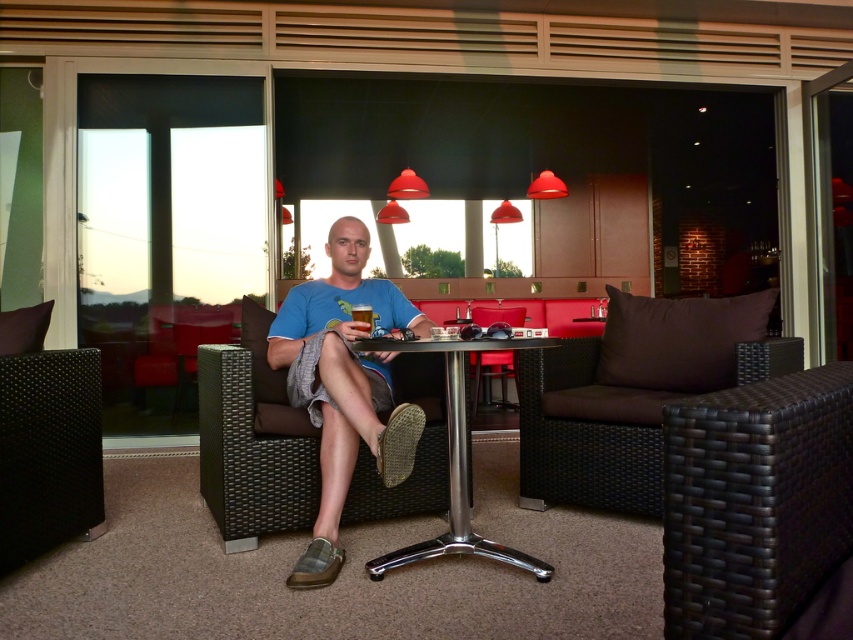
Question: Is brown wicker chair at center below brown wicker armchair at center?

Choices:
 (A) yes
 (B) no

Answer: (B)

Question: Does brown woven couch at center appear on the left side of brown wicker chair at center?

Choices:
 (A) no
 (B) yes

Answer: (A)

Question: From the image, what is the correct spatial relationship of blue fabric shirt at center in relation to translucent glass beer at center?

Choices:
 (A) above
 (B) below

Answer: (B)

Question: Which point is closer to the camera?

Choices:
 (A) brown woven chair at right
 (B) transparent glass door at upper left

Answer: (A)

Question: Which of the following is the farthest from the observer?

Choices:
 (A) pos(218,324)
 (B) pos(728,451)

Answer: (A)

Question: Which point appears farthest from the camera in this image?

Choices:
 (A) (366, 305)
 (B) (631, 481)
 (C) (184, 314)

Answer: (C)